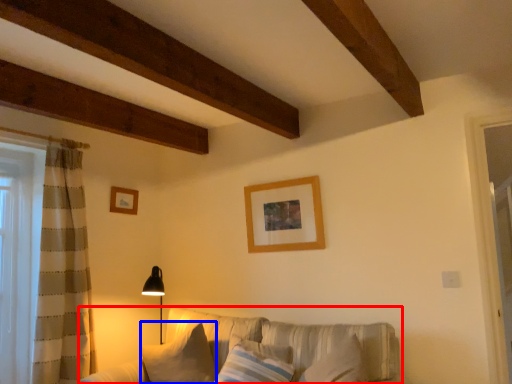
Question: Among these objects, which one is farthest to the camera, studio couch (highlighted by a red box) or pillow (highlighted by a blue box)?

Choices:
 (A) studio couch
 (B) pillow

Answer: (B)